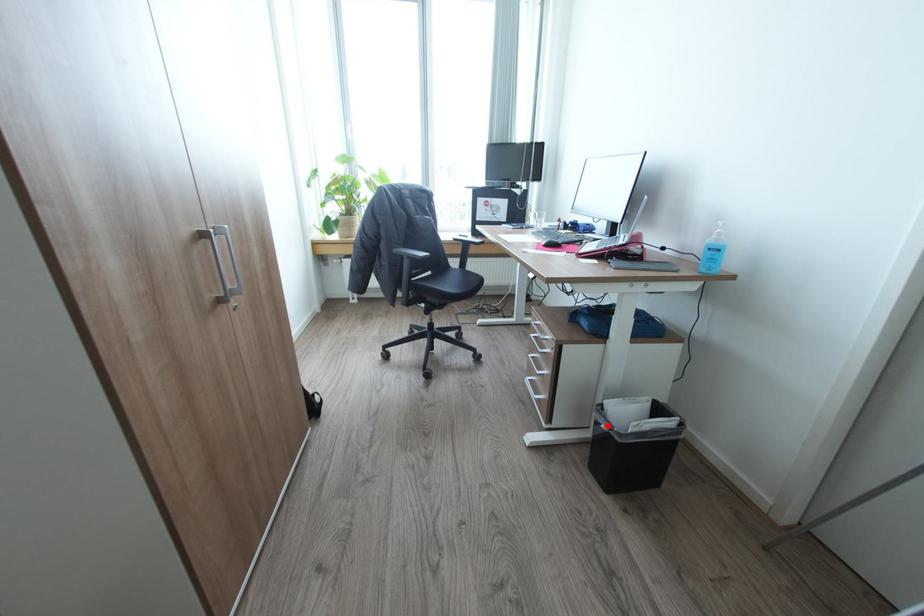
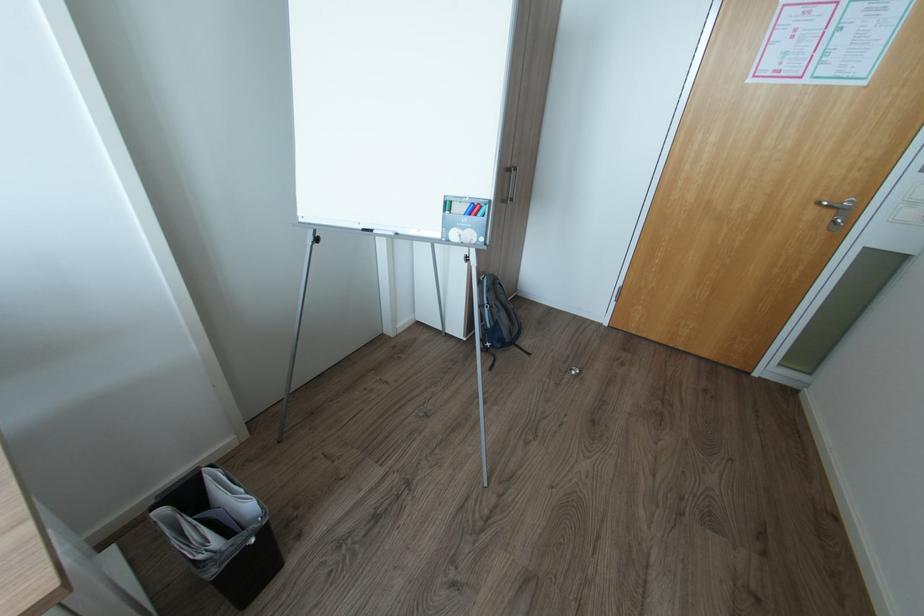
Question: I am providing you with two images of the same scene from different viewpoints. Given a red point in image1, look at the same physical point in image2. Is it:

Choices:
 (A) Closer to the viewpoint
 (B) Farther from the viewpoint

Answer: (B)